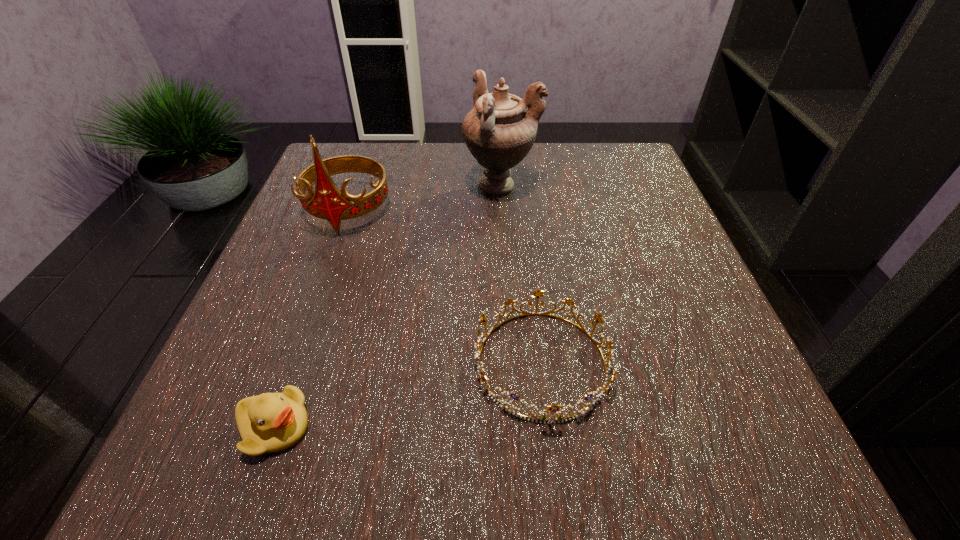
Where is `tiara present at the far edge`? The image size is (960, 540). tiara present at the far edge is located at coordinates (328, 203).

You are a GUI agent. You are given a task and a screenshot of the screen. Output one action in this format:
    pyautogui.click(x=<x>, y=<y>)
    Task: Click on the duckling that is at the near edge
    This screenshot has width=960, height=540.
    Given the screenshot: What is the action you would take?
    pyautogui.click(x=270, y=422)

Identify the location of tiara located at the near edge. (554, 408).

Locate an element on the screen. The image size is (960, 540). tiara positioned at the left edge is located at coordinates (328, 203).

Locate an element on the screen. duckling that is positioned at the left edge is located at coordinates (270, 422).

The image size is (960, 540). I want to click on object positioned at the far left corner, so (x=328, y=203).

Where is `object that is positioned at the near left corner`? The image size is (960, 540). object that is positioned at the near left corner is located at coordinates (x=270, y=422).

This screenshot has height=540, width=960. In the image, there is a desktop. Identify the location of vacant area at the far edge. (442, 190).

At what (x,y) coordinates should I click in order to perform the action: click on vacant space at the near edge of the desktop. Please return your answer as a coordinate pair (x, y). Looking at the image, I should click on (384, 468).

Identify the location of vacant space at the left edge. (276, 256).